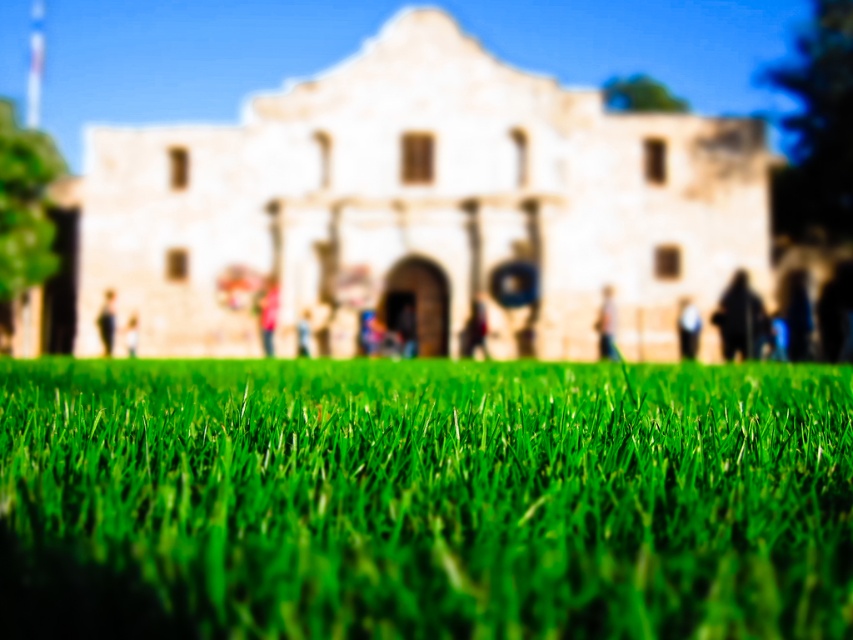
Based on the photo, who is lower down, light brown leather jacket at center or light brown wooden chair at center?

Positioned lower is light brown leather jacket at center.

Does light brown leather jacket at center appear on the right side of light brown wooden chair at center?

Correct, you'll find light brown leather jacket at center to the right of light brown wooden chair at center.

Is point (601, 308) positioned in front of point (299, 337)?

Yes, point (601, 308) is in front of point (299, 337).

Locate an element on the screen. The height and width of the screenshot is (640, 853). light brown leather jacket at center is located at coordinates (607, 324).

Is black matte person at center to the right of light brown wooden person at center from the viewer's perspective?

Yes, black matte person at center is to the right of light brown wooden person at center.

Which of these two, black matte person at center or light brown wooden person at center, stands taller?

With more height is light brown wooden person at center.

The height and width of the screenshot is (640, 853). What are the coordinates of `black matte person at center` in the screenshot? It's located at (688, 328).

Image resolution: width=853 pixels, height=640 pixels. What do you see at coordinates (607, 324) in the screenshot? I see `light brown leather jacket at center` at bounding box center [607, 324].

Is light brown leather jacket at center taller than black matte person at center?

Yes.

Identify the location of light brown leather jacket at center. This screenshot has width=853, height=640. (607, 324).